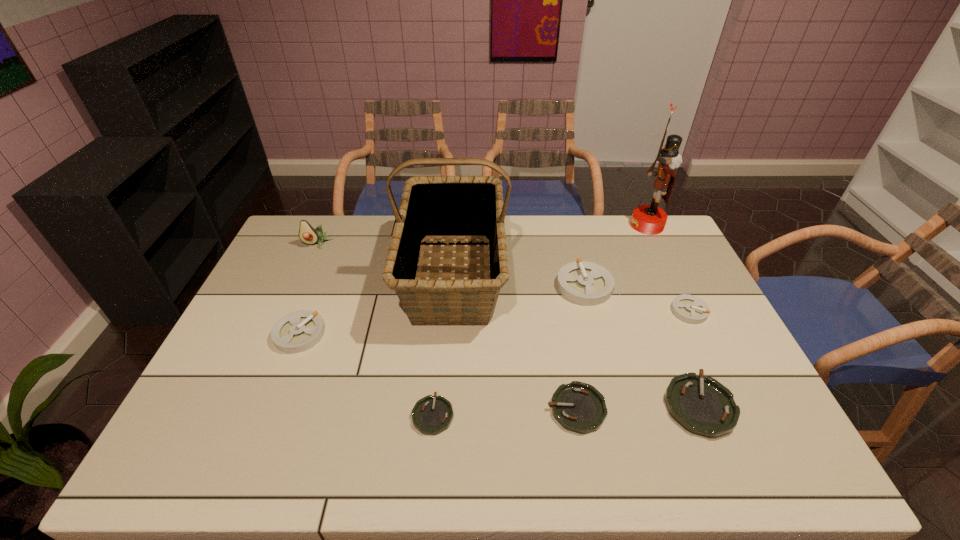
You are a GUI agent. You are given a task and a screenshot of the screen. Output one action in this format:
    pyautogui.click(x=<x>, y=<y>)
    Task: Click on the nutcracker
    Image resolution: width=960 pixels, height=540 pixels.
    Given the screenshot: What is the action you would take?
    pyautogui.click(x=648, y=219)

Where is `basket`? This screenshot has height=540, width=960. basket is located at coordinates (432, 207).

Identify the location of avocado. (307, 234).

I want to click on the sixth shortest object, so click(585, 283).

This screenshot has height=540, width=960. Find the location of `the biggest gray ashtray`. the biggest gray ashtray is located at coordinates (585, 283).

Where is `the fifth tallest object`? Image resolution: width=960 pixels, height=540 pixels. the fifth tallest object is located at coordinates (298, 331).

This screenshot has width=960, height=540. I want to click on the leftmost ashtray, so click(298, 331).

The width and height of the screenshot is (960, 540). What are the coordinates of `the biggest green ashtray` in the screenshot? It's located at (703, 406).

The width and height of the screenshot is (960, 540). Identify the location of the rightmost gray ashtray. (690, 309).

The height and width of the screenshot is (540, 960). In order to click on the second smallest green ashtray in this screenshot , I will do `click(579, 407)`.